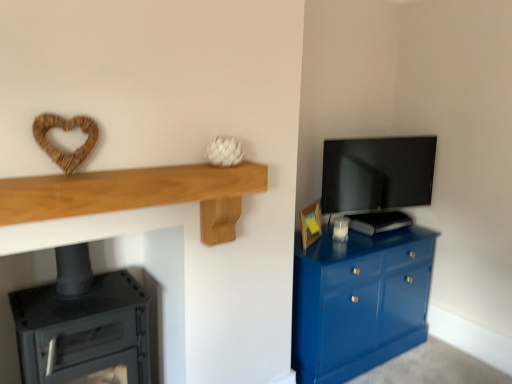
Question: Can you confirm if matte black tv at upper right is taller than black matte stove at lower left?

Choices:
 (A) no
 (B) yes

Answer: (A)

Question: Considering the relative positions of matte black tv at upper right and black matte stove at lower left in the image provided, is matte black tv at upper right to the left of black matte stove at lower left from the viewer's perspective?

Choices:
 (A) yes
 (B) no

Answer: (B)

Question: Does matte black tv at upper right have a greater width compared to black matte stove at lower left?

Choices:
 (A) yes
 (B) no

Answer: (B)

Question: Is the depth of matte black tv at upper right less than that of black matte stove at lower left?

Choices:
 (A) yes
 (B) no

Answer: (B)

Question: Is matte black tv at upper right surrounding black matte stove at lower left?

Choices:
 (A) yes
 (B) no

Answer: (B)

Question: From the image's perspective, is wooden picture frame at right positioned above or below black matte stove at lower left?

Choices:
 (A) below
 (B) above

Answer: (B)

Question: Looking at the image, does wooden picture frame at right seem bigger or smaller compared to black matte stove at lower left?

Choices:
 (A) big
 (B) small

Answer: (B)

Question: Based on their positions, is wooden picture frame at right located to the left or right of black matte stove at lower left?

Choices:
 (A) right
 (B) left

Answer: (A)

Question: Is wooden picture frame at right inside or outside of black matte stove at lower left?

Choices:
 (A) outside
 (B) inside

Answer: (A)

Question: From their relative heights in the image, would you say matte black tv at upper right is taller or shorter than wooden picture frame at right?

Choices:
 (A) short
 (B) tall

Answer: (B)

Question: Considering the relative positions of matte black tv at upper right and wooden picture frame at right in the image provided, is matte black tv at upper right to the left or to the right of wooden picture frame at right?

Choices:
 (A) left
 (B) right

Answer: (B)

Question: Considering the positions of point (406, 140) and point (309, 225), is point (406, 140) closer or farther from the camera than point (309, 225)?

Choices:
 (A) farther
 (B) closer

Answer: (A)

Question: From a real-world perspective, is matte black tv at upper right positioned above or below wooden picture frame at right?

Choices:
 (A) below
 (B) above

Answer: (B)

Question: Is light oak wood shelf at upper left bigger or smaller than glossy blue cabinet at right?

Choices:
 (A) small
 (B) big

Answer: (A)

Question: In terms of width, does light oak wood shelf at upper left look wider or thinner when compared to glossy blue cabinet at right?

Choices:
 (A) thin
 (B) wide

Answer: (A)